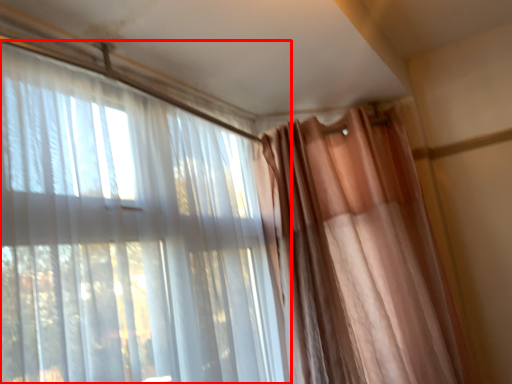
Question: Considering the relative positions of curtain (annotated by the red box) and curtain in the image provided, where is curtain (annotated by the red box) located with respect to the staircase?

Choices:
 (A) left
 (B) right

Answer: (A)